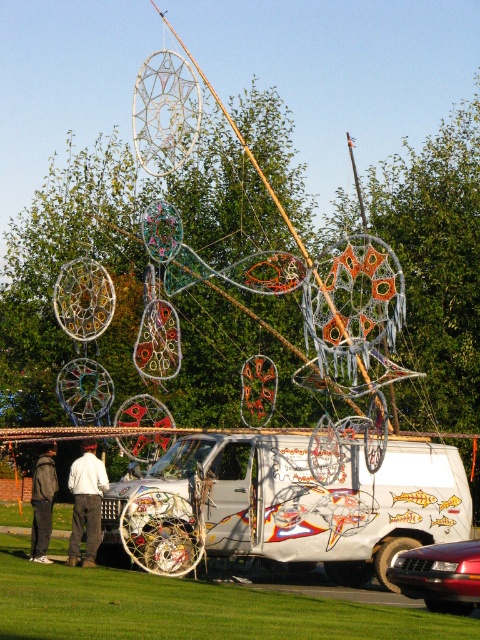
Question: Is white matte van at center closer to the viewer compared to white cotton pants at lower left?

Choices:
 (A) yes
 (B) no

Answer: (B)

Question: Does shiny red car at lower right have a greater width compared to white cotton pants at lower left?

Choices:
 (A) no
 (B) yes

Answer: (B)

Question: Which point appears closest to the camera in this image?

Choices:
 (A) (428, 557)
 (B) (45, 445)
 (C) (87, 538)

Answer: (A)

Question: Which object is positioned farthest from the white cotton pants at lower left?

Choices:
 (A) shiny red car at lower right
 (B) dark gray hoodie at lower left
 (C) white matte van at center

Answer: (C)

Question: Which point is farther to the camera?

Choices:
 (A) shiny red car at lower right
 (B) white cotton pants at lower left

Answer: (B)

Question: Is shiny red car at lower right wider than dark gray hoodie at lower left?

Choices:
 (A) yes
 (B) no

Answer: (A)